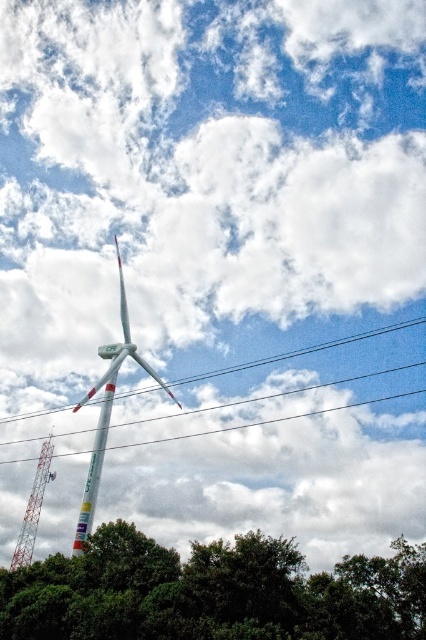
You are standing in a forest clearing and see the green leafy tree at lower center and the white painted metal wind turbine at center. Which object appears wider from your perspective?

The green leafy tree at lower center might be wider than the white painted metal wind turbine at center.

From the picture: You are standing at the base of the wind turbine and want to know what is located at the coordinates point (264, 396). What object is at that point?

The white plastic power line at center is located at point (264, 396).